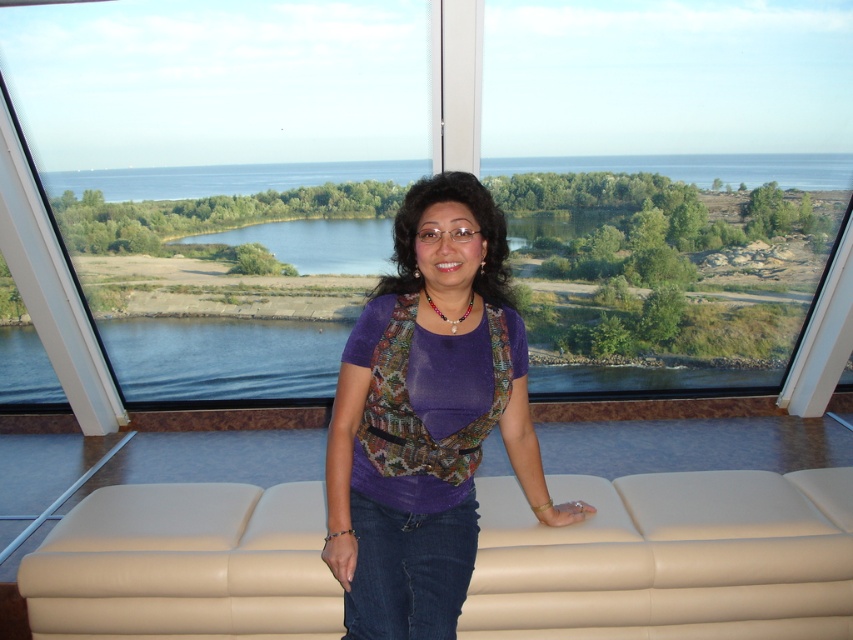
Question: Which point is closer to the camera?

Choices:
 (A) (689, 193)
 (B) (596, 554)

Answer: (B)

Question: Is transparent glass window at center below purple fabric top at center?

Choices:
 (A) no
 (B) yes

Answer: (A)

Question: Is transparent glass window at center further to camera compared to purple fabric top at center?

Choices:
 (A) no
 (B) yes

Answer: (B)

Question: Among these points, which one is nearest to the camera?

Choices:
 (A) pos(91,218)
 (B) pos(427,435)

Answer: (B)

Question: Can you confirm if transparent glass window at center is smaller than beige leather couch at lower center?

Choices:
 (A) no
 (B) yes

Answer: (A)

Question: Which point is closer to the camera?

Choices:
 (A) (843, 598)
 (B) (389, 528)

Answer: (B)